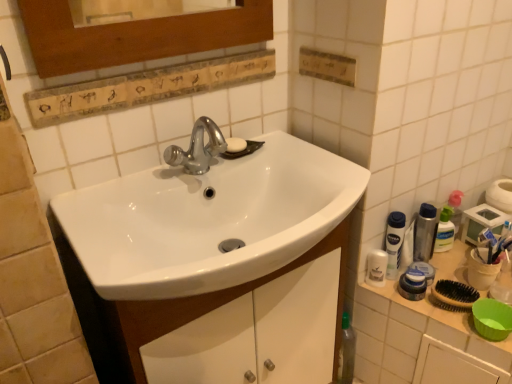
In order to click on vacant area that is in front of white plastic bottle at right, the 4th mouthwash viewed from the right in this screenshot , I will do `click(416, 309)`.